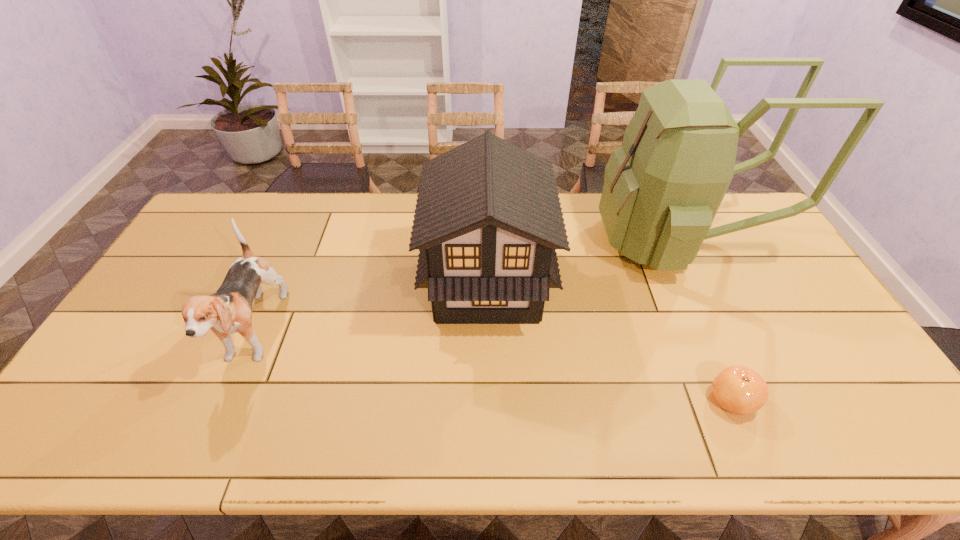
At what (x,y) coordinates should I click in order to perform the action: click on free region located on the front-facing side of the second tallest object. Please return your answer as a coordinate pair (x, y). The height and width of the screenshot is (540, 960). Looking at the image, I should click on (407, 284).

Locate an element on the screen. vacant space located 0.290m on the front-facing side of the second tallest object is located at coordinates (328, 284).

Identify the location of vacant space located 0.120m at the face of the third tallest object. Image resolution: width=960 pixels, height=540 pixels. (209, 437).

You are a GUI agent. You are given a task and a screenshot of the screen. Output one action in this format:
    pyautogui.click(x=<x>, y=<y>)
    Task: Click on the free space located 0.120m on the right of the shortest object
    Image resolution: width=960 pixels, height=540 pixels.
    Given the screenshot: What is the action you would take?
    pyautogui.click(x=804, y=400)

Find the location of a particular element. object located in the far edge section of the desktop is located at coordinates point(662,188).

This screenshot has height=540, width=960. I want to click on object present at the near edge, so click(740, 390).

Where is `object at the right edge`? object at the right edge is located at coordinates (662, 188).

Where is `object present at the far right corner`? The height and width of the screenshot is (540, 960). object present at the far right corner is located at coordinates (662, 188).

The image size is (960, 540). In the image, there is a desktop. Find the location of `vacant space at the far edge`. vacant space at the far edge is located at coordinates (265, 205).

You are a GUI agent. You are given a task and a screenshot of the screen. Output one action in this format:
    pyautogui.click(x=<x>, y=<y>)
    Task: Click on the vacant space at the near edge of the desktop
    Image resolution: width=960 pixels, height=540 pixels.
    Given the screenshot: What is the action you would take?
    pyautogui.click(x=262, y=448)